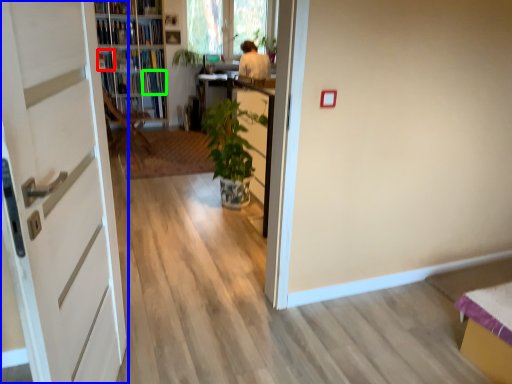
Question: Estimate the real-world distances between objects in this image. Which object is farther from book (highlighted by a red box), door (highlighted by a blue box) or book (highlighted by a green box)?

Choices:
 (A) door
 (B) book

Answer: (A)